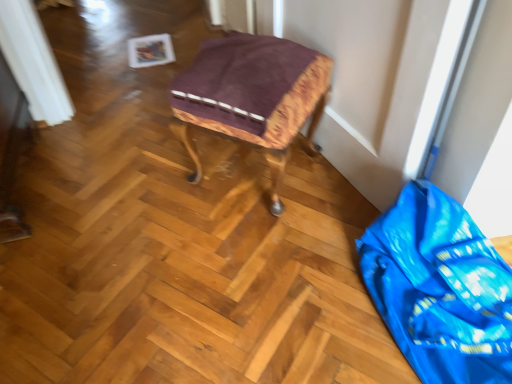
At what (x,y) coordinates should I click in order to perform the action: click on free spot in front of wooden stool at center. Please return your answer as a coordinate pair (x, y). The height and width of the screenshot is (384, 512). Looking at the image, I should click on (257, 252).